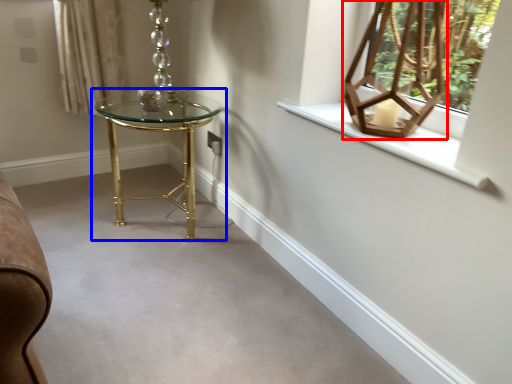
Question: Which object appears closest to the camera in this image, table lamp (highlighted by a red box) or table (highlighted by a blue box)?

Choices:
 (A) table lamp
 (B) table

Answer: (A)